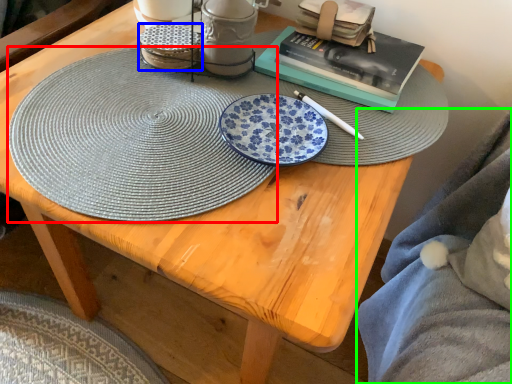
Question: Which object is positioned farthest from platter (highlighted by a red box)? Select from tableware (highlighted by a blue box) and blanket (highlighted by a green box).

Choices:
 (A) tableware
 (B) blanket

Answer: (B)